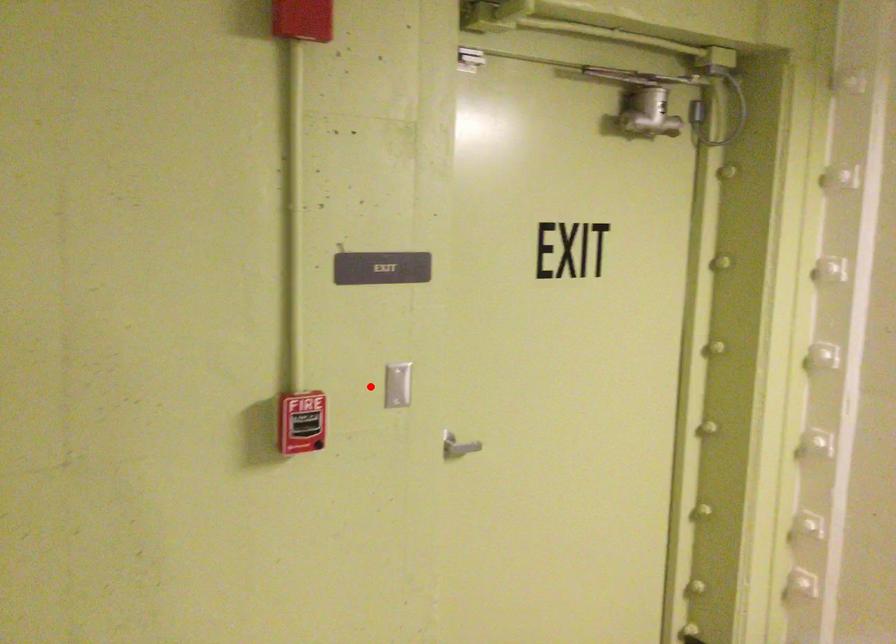
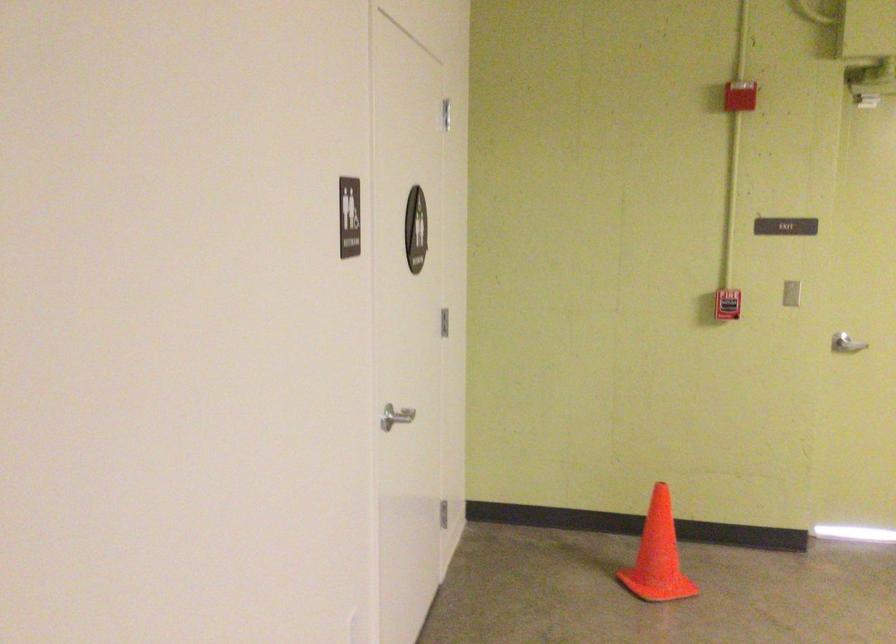
Question: I am providing you with two images of the same scene from different viewpoints. A red point is marked on the first image. Can you still see the location of the red point in image 2?

Choices:
 (A) Yes
 (B) No

Answer: (A)